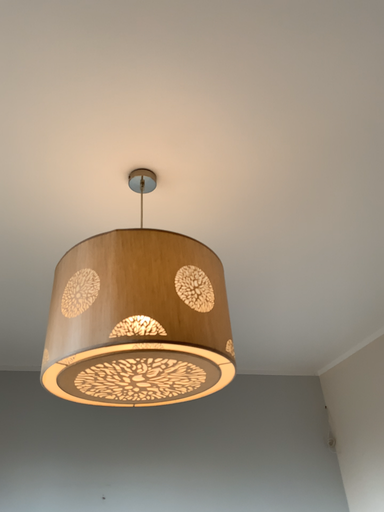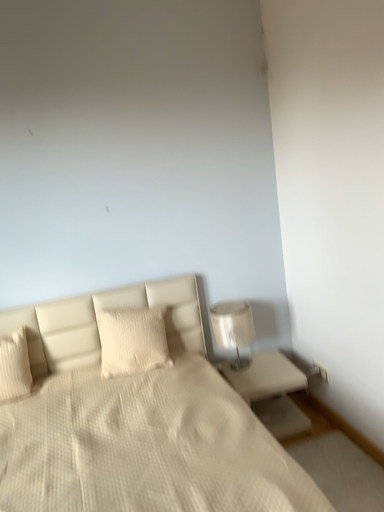
Question: Which way did the camera rotate in the video?

Choices:
 (A) rotated upward
 (B) rotated downward

Answer: (B)